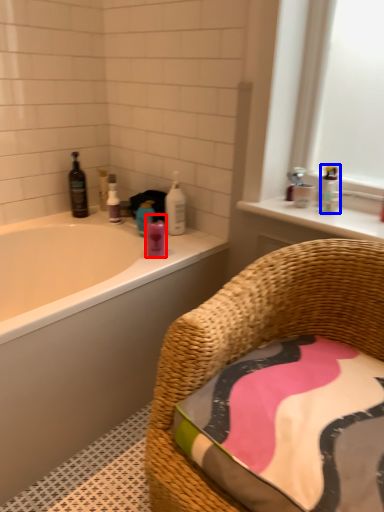
Question: Which object is further to the camera taking this photo, toiletry (highlighted by a red box) or toiletry (highlighted by a blue box)?

Choices:
 (A) toiletry
 (B) toiletry

Answer: (B)